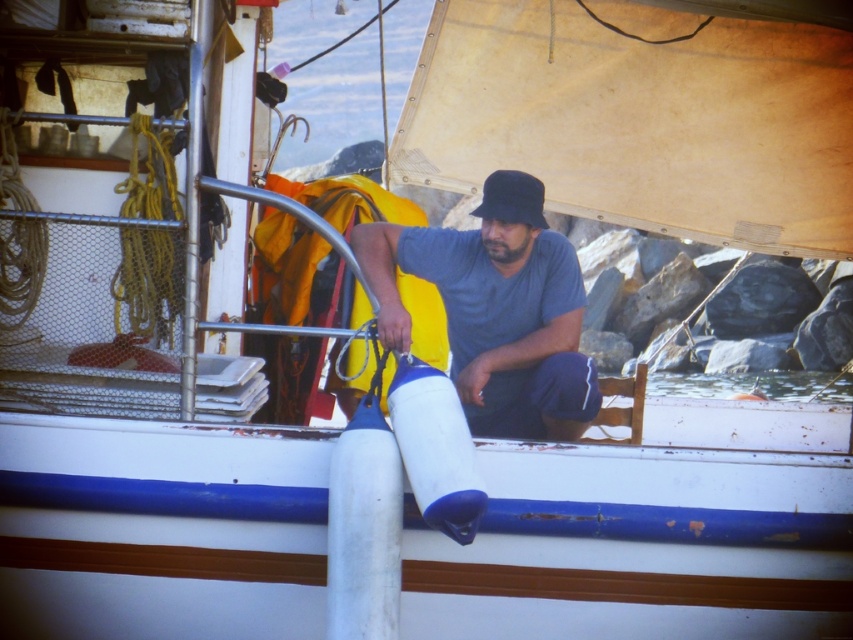
Question: Which point appears farthest from the camera in this image?

Choices:
 (A) (376, 328)
 (B) (520, 204)

Answer: (B)

Question: Which object is the closest to the clear water at lower center?

Choices:
 (A) black fabric baseball hat at center
 (B) gray matte shirt at center

Answer: (A)

Question: Is gray matte shirt at center below black fabric baseball hat at center?

Choices:
 (A) no
 (B) yes

Answer: (B)

Question: Does gray matte shirt at center come in front of clear water at lower center?

Choices:
 (A) no
 (B) yes

Answer: (B)

Question: Which point appears farthest from the camera in this image?

Choices:
 (A) (780, 378)
 (B) (502, 172)

Answer: (A)

Question: Is gray matte shirt at center thinner than black fabric baseball hat at center?

Choices:
 (A) yes
 (B) no

Answer: (B)